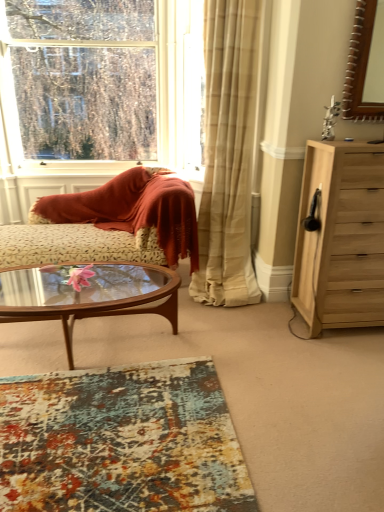
The height and width of the screenshot is (512, 384). I want to click on textured multicolored rug at lower center, so click(x=121, y=441).

What do you see at coordinates (365, 64) in the screenshot?
I see `wooden mirror at upper right` at bounding box center [365, 64].

Locate an element on the screen. This screenshot has height=512, width=384. clear glass window at upper left is located at coordinates (100, 89).

Identify the location of beige plaid curtain at center. (228, 155).

What do you see at coordinates (341, 237) in the screenshot?
I see `light wood chest of drawers at right` at bounding box center [341, 237].

Locate an element on the screen. The image size is (384, 512). textured multicolored rug at lower center is located at coordinates (121, 441).

Is textured multicolored rug at lower center turned away from transparent glass coffee table at center?

No, textured multicolored rug at lower center is not facing away from transparent glass coffee table at center.

Is textured multicolored rug at lower center positioned far away from transparent glass coffee table at center?

No, textured multicolored rug at lower center is not far away from transparent glass coffee table at center.

I want to click on plain in front of the transparent glass coffee table at center, so (x=121, y=441).

Is point (216, 460) positioned before point (145, 294)?

Yes, point (216, 460) is in front of point (145, 294).

Is textured multicolored rug at lower center aimed at floral-patterned fabric couch at center?

No, textured multicolored rug at lower center is not turned towards floral-patterned fabric couch at center.

Is textured multicolored rug at lower center completely or partially outside of floral-patterned fabric couch at center?

Yes, textured multicolored rug at lower center is located beyond the bounds of floral-patterned fabric couch at center.

Find the location of a particular element. plain on the right of the floral-patterned fabric couch at center is located at coordinates (121, 441).

Which point is more forward, (223,426) or (71,257)?

Positioned in front is point (223,426).

Is beige plaid curtain at center in front of clear glass window at upper left?

Yes, the depth of beige plaid curtain at center is less than that of clear glass window at upper left.

Is the surface of beige plaid curtain at center in direct contact with clear glass window at upper left?

beige plaid curtain at center and clear glass window at upper left are not in contact.

Who is smaller, beige plaid curtain at center or clear glass window at upper left?

clear glass window at upper left is smaller.

Is beige plaid curtain at center taller or shorter than clear glass window at upper left?

beige plaid curtain at center is taller than clear glass window at upper left.

Between clear glass window at upper left and textured multicolored rug at lower center, which one has larger width?

Wider between the two is textured multicolored rug at lower center.

Does clear glass window at upper left have a larger size compared to textured multicolored rug at lower center?

Yes.

Considering the positions of point (165, 15) and point (227, 476), is point (165, 15) closer or farther from the camera than point (227, 476)?

Point (165, 15) is farther from the camera than point (227, 476).

From the image's perspective, is clear glass window at upper left located above or below textured multicolored rug at lower center?

From the image's perspective, clear glass window at upper left appears above textured multicolored rug at lower center.

Which of these two, beige plaid curtain at center or floral-patterned fabric couch at center, is thinner?

With smaller width is floral-patterned fabric couch at center.

From the image's perspective, would you say beige plaid curtain at center is shown under floral-patterned fabric couch at center?

No, from the image's perspective, beige plaid curtain at center is not beneath floral-patterned fabric couch at center.

Considering the sizes of beige plaid curtain at center and floral-patterned fabric couch at center in the image, is beige plaid curtain at center taller or shorter than floral-patterned fabric couch at center?

Clearly, beige plaid curtain at center is taller compared to floral-patterned fabric couch at center.

Considering the positions of objects beige plaid curtain at center and floral-patterned fabric couch at center in the image provided, who is more to the left, beige plaid curtain at center or floral-patterned fabric couch at center?

floral-patterned fabric couch at center.

Can you tell me how much light wood chest of drawers at right and floral-patterned fabric couch at center differ in facing direction?

The angular difference between light wood chest of drawers at right and floral-patterned fabric couch at center is 3.53 degrees.

Is light wood chest of drawers at right further to camera compared to floral-patterned fabric couch at center?

No, it is in front of floral-patterned fabric couch at center.

Based on the photo, considering the positions of objects light wood chest of drawers at right and floral-patterned fabric couch at center in the image provided, who is more to the left, light wood chest of drawers at right or floral-patterned fabric couch at center?

floral-patterned fabric couch at center.

Could you tell me if light wood chest of drawers at right is turned towards floral-patterned fabric couch at center?

No, light wood chest of drawers at right is not oriented towards floral-patterned fabric couch at center.

Is wooden mirror at upper right thinner than transparent glass coffee table at center?

Correct, the width of wooden mirror at upper right is less than that of transparent glass coffee table at center.

In the scene shown: Could you tell me if wooden mirror at upper right is turned towards transparent glass coffee table at center?

No, wooden mirror at upper right is not aimed at transparent glass coffee table at center.

Is transparent glass coffee table at center completely or partially inside wooden mirror at upper right?

No, wooden mirror at upper right does not contain transparent glass coffee table at center.

I want to click on plain that is under the transparent glass coffee table at center (from a real-world perspective), so click(x=121, y=441).

This screenshot has height=512, width=384. Identify the location of studio couch to the left of textured multicolored rug at lower center. (110, 224).

Which object lies nearer to the anchor point beige plaid curtain at center, transparent glass coffee table at center or clear glass window at upper left?

Based on the image, transparent glass coffee table at center appears to be nearer to beige plaid curtain at center.

Looking at the image, which one is located further to transparent glass coffee table at center, beige plaid curtain at center or light wood chest of drawers at right?

light wood chest of drawers at right is further to transparent glass coffee table at center.

Based on the photo, from the image, which object appears to be farther from floral-patterned fabric couch at center, beige plaid curtain at center or light wood chest of drawers at right?

Based on the image, light wood chest of drawers at right appears to be further to floral-patterned fabric couch at center.

Looking at the image, which one is located further to light wood chest of drawers at right, wooden mirror at upper right or clear glass window at upper left?

Among the two, clear glass window at upper left is located further to light wood chest of drawers at right.

Looking at the image, which one is located closer to light wood chest of drawers at right, beige plaid curtain at center or textured multicolored rug at lower center?

Among the two, beige plaid curtain at center is located nearer to light wood chest of drawers at right.

Considering their positions, is wooden mirror at upper right positioned further to textured multicolored rug at lower center than beige plaid curtain at center?

wooden mirror at upper right.

Considering their positions, is transparent glass coffee table at center positioned further to beige plaid curtain at center than floral-patterned fabric couch at center?

transparent glass coffee table at center is positioned further to the anchor beige plaid curtain at center.

When comparing their distances from wooden mirror at upper right, does beige plaid curtain at center or textured multicolored rug at lower center seem further?

Based on the image, textured multicolored rug at lower center appears to be further to wooden mirror at upper right.

The image size is (384, 512). I want to click on coffee table between clear glass window at upper left and wooden mirror at upper right in the horizontal direction, so click(88, 294).

This screenshot has height=512, width=384. What are the coordinates of `studio couch between beige plaid curtain at center and transparent glass coffee table at center from top to bottom` in the screenshot? It's located at (110, 224).

Find the location of `the chest of drawers between clear glass window at upper left and textured multicolored rug at lower center vertically`. the chest of drawers between clear glass window at upper left and textured multicolored rug at lower center vertically is located at coordinates (341, 237).

I want to click on studio couch between clear glass window at upper left and textured multicolored rug at lower center vertically, so click(110, 224).